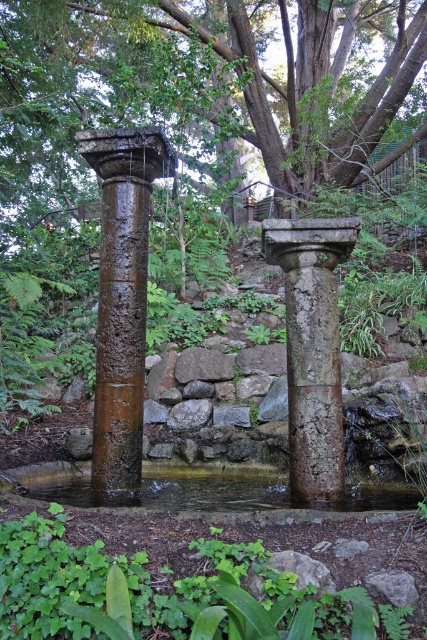
Does rusty stone column at left have a lesser height compared to clear water at center?

No.

Can you confirm if rusty stone column at left is positioned below clear water at center?

No, rusty stone column at left is not below clear water at center.

Is point (114, 349) more distant than point (225, 483)?

That is False.

Where is `rusty stone column at left`? Image resolution: width=427 pixels, height=640 pixels. rusty stone column at left is located at coordinates (122, 296).

Does point (348, 176) lie in front of point (199, 499)?

No.

Locate an element on the screen. Image resolution: width=427 pixels, height=640 pixels. green leafy tree at center is located at coordinates (201, 81).

Is point (64, 179) farther from camera compared to point (81, 506)?

That is True.

Where is `green leafy tree at center`? green leafy tree at center is located at coordinates (201, 81).

Between point (102, 634) and point (219, 483), which one is positioned behind?

The point (219, 483) is more distant.

Which is in front, point (263, 616) or point (380, 484)?

Positioned in front is point (263, 616).

Image resolution: width=427 pixels, height=640 pixels. In order to click on green leafy plant at lower center in this screenshot , I will do `click(166, 593)`.